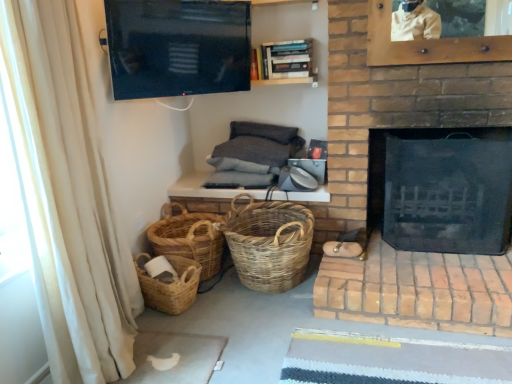
The height and width of the screenshot is (384, 512). I want to click on blank space above woven natural basket at lower left, positioned as the third basket in right-to-left order (from a real-world perspective), so click(160, 261).